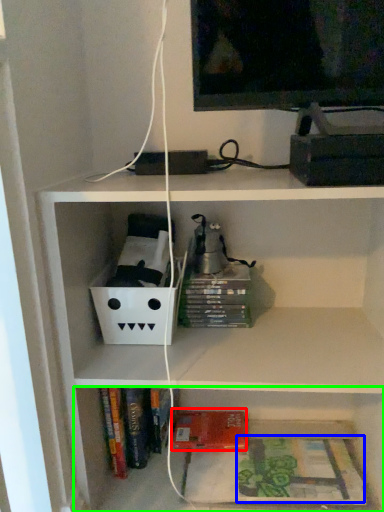
Question: Which object is positioned farthest from paperback book (highlighted by a red box)? Select from book (highlighted by a blue box) and shelf (highlighted by a green box).

Choices:
 (A) book
 (B) shelf

Answer: (A)